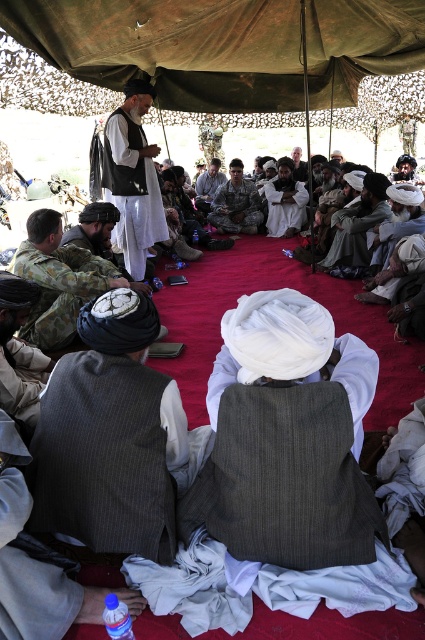
Question: Which of the following is the farthest from the observer?

Choices:
 (A) (53, 497)
 (B) (112, 252)
 (C) (268, 196)
 (D) (359, 257)

Answer: (C)

Question: Can you confirm if dark gray fabric vest at lower left is positioned below dark gray uniform at center?

Choices:
 (A) yes
 (B) no

Answer: (A)

Question: Can you confirm if gray woolen vest at center is positioned to the right of blue plastic bottle at lower left?

Choices:
 (A) no
 (B) yes

Answer: (A)

Question: Can you confirm if camouflage fabric bag at left is positioned to the left of camouflage fabric uniform at center?

Choices:
 (A) yes
 (B) no

Answer: (A)

Question: Among these points, which one is farthest from the camera?

Choices:
 (A) (121, 410)
 (B) (212, 182)
 (C) (91, 204)
 (D) (223, 186)

Answer: (B)

Question: Which point is farther to the camera?

Choices:
 (A) gray woolen turban at center
 (B) gray woolen vest at center

Answer: (A)